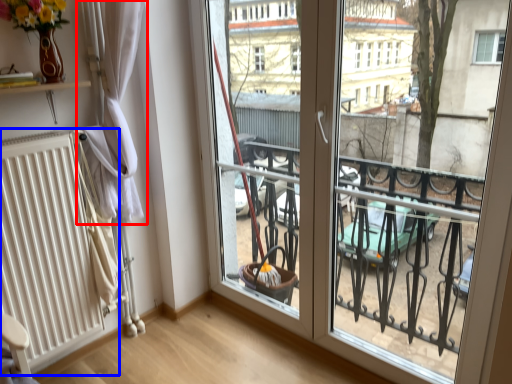
Question: Which object is further to the camera taking this photo, curtain (highlighted by a red box) or radiator (highlighted by a blue box)?

Choices:
 (A) curtain
 (B) radiator

Answer: (A)